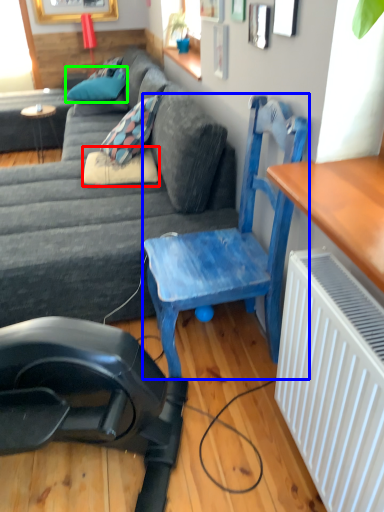
Question: Considering the real-world distances, which object is closest to pillow (highlighted by a red box)? chair (highlighted by a blue box) or pillow (highlighted by a green box).

Choices:
 (A) chair
 (B) pillow

Answer: (A)